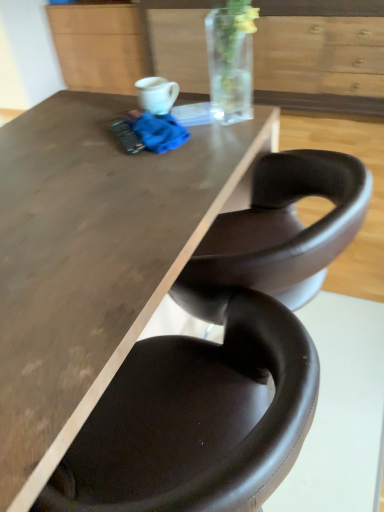
Question: Considering the relative sizes of white glossy mug at upper center and brown leather chair at lower center in the image provided, is white glossy mug at upper center smaller than brown leather chair at lower center?

Choices:
 (A) yes
 (B) no

Answer: (A)

Question: Considering the relative sizes of white glossy mug at upper center and brown leather chair at lower center in the image provided, is white glossy mug at upper center taller than brown leather chair at lower center?

Choices:
 (A) yes
 (B) no

Answer: (B)

Question: Can you confirm if white glossy mug at upper center is thinner than brown leather chair at lower center?

Choices:
 (A) yes
 (B) no

Answer: (A)

Question: From a real-world perspective, is white glossy mug at upper center physically above brown leather chair at lower center?

Choices:
 (A) yes
 (B) no

Answer: (A)

Question: Does white glossy mug at upper center have a lesser height compared to brown leather chair at lower center?

Choices:
 (A) yes
 (B) no

Answer: (A)

Question: Is brown leather chair at lower center at the back of white glossy mug at upper center?

Choices:
 (A) yes
 (B) no

Answer: (B)

Question: Is matte wood cabinet at upper center looking in the opposite direction of wooden drawer at upper center?

Choices:
 (A) no
 (B) yes

Answer: (A)

Question: Does matte wood cabinet at upper center have a greater height compared to wooden drawer at upper center?

Choices:
 (A) no
 (B) yes

Answer: (A)

Question: From the image's perspective, is matte wood cabinet at upper center under wooden drawer at upper center?

Choices:
 (A) no
 (B) yes

Answer: (A)

Question: Is matte wood cabinet at upper center wider than wooden drawer at upper center?

Choices:
 (A) no
 (B) yes

Answer: (A)

Question: From a real-world perspective, does matte wood cabinet at upper center stand above wooden drawer at upper center?

Choices:
 (A) yes
 (B) no

Answer: (B)

Question: Considering the relative sizes of matte wood cabinet at upper center and wooden drawer at upper center in the image provided, is matte wood cabinet at upper center smaller than wooden drawer at upper center?

Choices:
 (A) yes
 (B) no

Answer: (A)

Question: Is matte brown table at center facing away from matte wood cabinet at upper center?

Choices:
 (A) yes
 (B) no

Answer: (B)